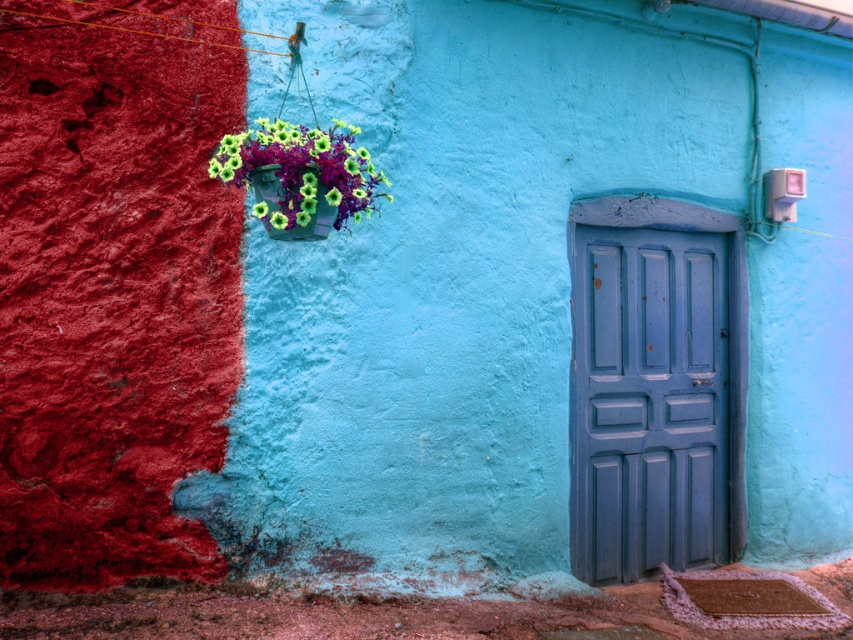
Which is more to the right, blue matte door at center or matte plastic flowers at upper left?

From the viewer's perspective, blue matte door at center appears more on the right side.

In the scene shown: Does blue matte door at center appear on the right side of matte plastic flowers at upper left?

Correct, you'll find blue matte door at center to the right of matte plastic flowers at upper left.

Is point (640, 449) positioned in front of point (277, 228)?

No, it is not.

Locate an element on the screen. blue matte door at center is located at coordinates (653, 397).